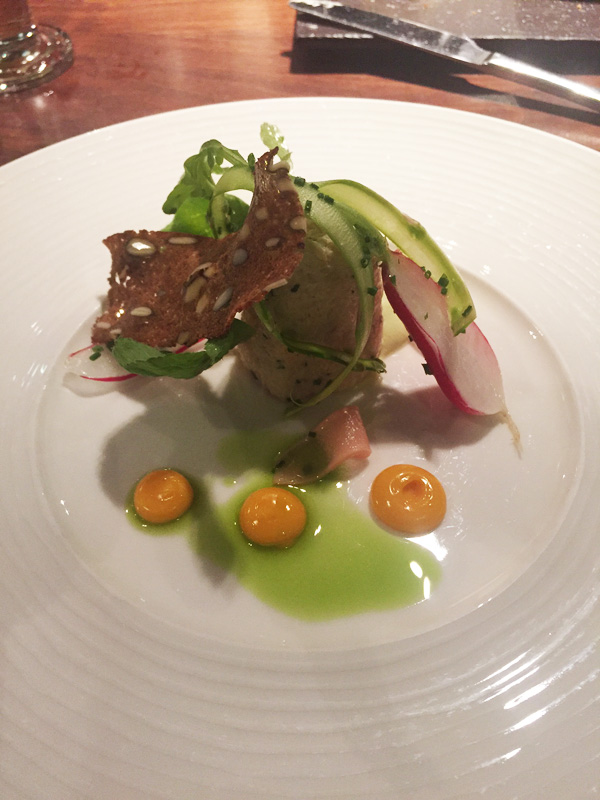
In order to click on plate in this screenshot , I will do `click(500, 217)`.